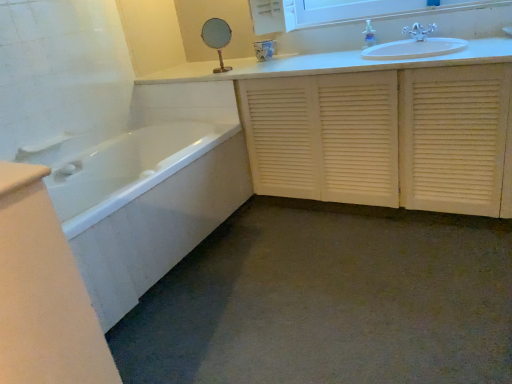
Question: Is white glossy medicine cabinet at upper center smaller than clear plastic soap dispenser at upper center?

Choices:
 (A) yes
 (B) no

Answer: (B)

Question: Is white glossy medicine cabinet at upper center thinner than clear plastic soap dispenser at upper center?

Choices:
 (A) no
 (B) yes

Answer: (A)

Question: Is white glossy medicine cabinet at upper center turned away from clear plastic soap dispenser at upper center?

Choices:
 (A) yes
 (B) no

Answer: (B)

Question: Does white glossy medicine cabinet at upper center turn towards clear plastic soap dispenser at upper center?

Choices:
 (A) yes
 (B) no

Answer: (B)

Question: Considering the relative sizes of white glossy medicine cabinet at upper center and clear plastic soap dispenser at upper center in the image provided, is white glossy medicine cabinet at upper center bigger than clear plastic soap dispenser at upper center?

Choices:
 (A) yes
 (B) no

Answer: (A)

Question: Is white louvered cabinet at center inside the boundaries of white glossy medicine cabinet at upper center, or outside?

Choices:
 (A) outside
 (B) inside

Answer: (A)

Question: Is white louvered cabinet at center in front of or behind white glossy medicine cabinet at upper center in the image?

Choices:
 (A) front
 (B) behind

Answer: (A)

Question: In the image, is white louvered cabinet at center on the left side or the right side of white glossy medicine cabinet at upper center?

Choices:
 (A) right
 (B) left

Answer: (B)

Question: In terms of height, does white louvered cabinet at center look taller or shorter compared to white glossy medicine cabinet at upper center?

Choices:
 (A) tall
 (B) short

Answer: (A)

Question: Which is correct: white glossy medicine cabinet at upper center is inside white plastic towel bar at left, or outside of it?

Choices:
 (A) outside
 (B) inside

Answer: (A)

Question: Considering the positions of white glossy medicine cabinet at upper center and white plastic towel bar at left in the image, is white glossy medicine cabinet at upper center wider or thinner than white plastic towel bar at left?

Choices:
 (A) wide
 (B) thin

Answer: (A)

Question: Looking at the image, does white glossy medicine cabinet at upper center seem bigger or smaller compared to white plastic towel bar at left?

Choices:
 (A) small
 (B) big

Answer: (B)

Question: Is white glossy medicine cabinet at upper center taller or shorter than white plastic towel bar at left?

Choices:
 (A) tall
 (B) short

Answer: (B)

Question: Is point (370, 19) closer or farther from the camera than point (490, 170)?

Choices:
 (A) farther
 (B) closer

Answer: (A)

Question: From a real-world perspective, is clear plastic soap dispenser at upper center above or below white louvered cabinet at center?

Choices:
 (A) below
 (B) above

Answer: (B)